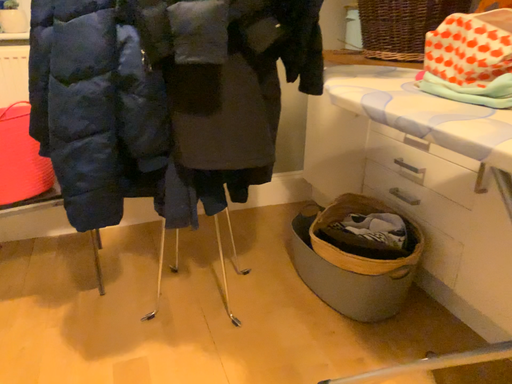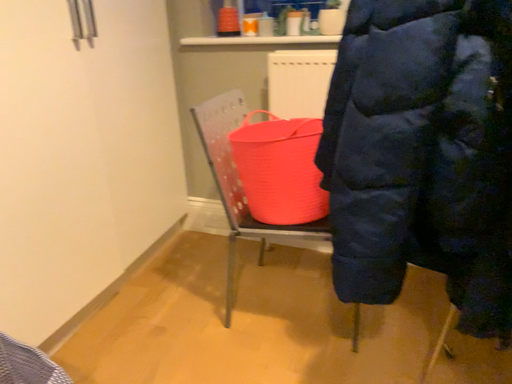
Question: How did the camera likely rotate when shooting the video?

Choices:
 (A) rotated left
 (B) rotated right

Answer: (A)